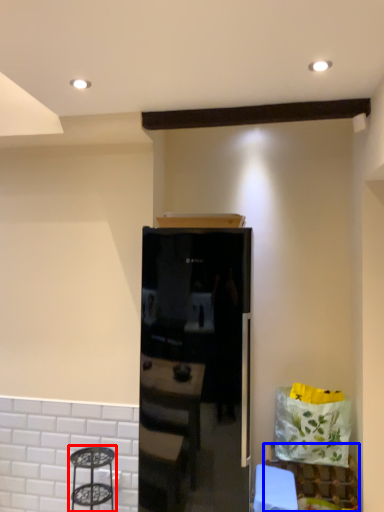
Question: Which object appears closest to the camera in this image, step stool (highlighted by a red box) or furniture (highlighted by a blue box)?

Choices:
 (A) step stool
 (B) furniture

Answer: (A)